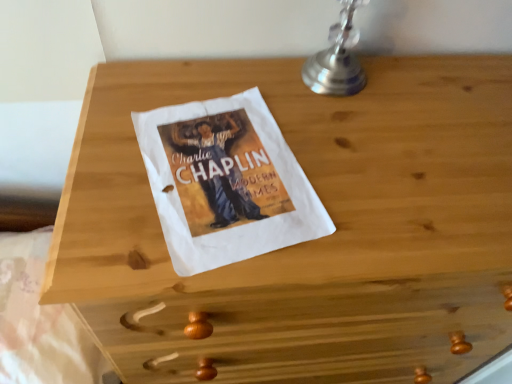
Where is `vacant space to the left of silver metallic table lamp at upper right`? vacant space to the left of silver metallic table lamp at upper right is located at coordinates (234, 84).